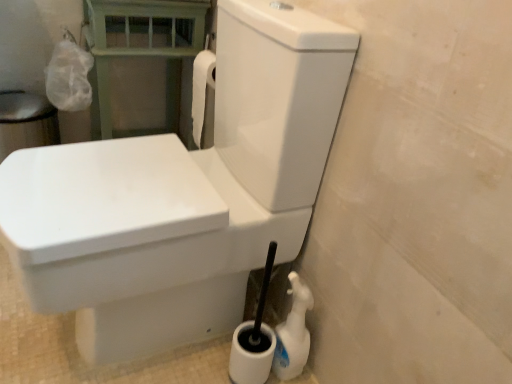
Question: Should I look upward or downward to see green painted wood balustrade at upper left?

Choices:
 (A) down
 (B) up

Answer: (B)

Question: Is white glossy toilet at center beside green painted wood balustrade at upper left?

Choices:
 (A) yes
 (B) no

Answer: (B)

Question: Is white glossy toilet at center aimed at green painted wood balustrade at upper left?

Choices:
 (A) no
 (B) yes

Answer: (A)

Question: Is white glossy toilet at center closer to camera compared to green painted wood balustrade at upper left?

Choices:
 (A) no
 (B) yes

Answer: (B)

Question: Can you confirm if white glossy toilet at center is positioned to the right of green painted wood balustrade at upper left?

Choices:
 (A) yes
 (B) no

Answer: (A)

Question: Is white glossy toilet at center looking in the opposite direction of green painted wood balustrade at upper left?

Choices:
 (A) yes
 (B) no

Answer: (B)

Question: From the image's perspective, would you say white glossy toilet at center is shown under green painted wood balustrade at upper left?

Choices:
 (A) no
 (B) yes

Answer: (B)

Question: Considering the relative sizes of white glossy toilet at center and white plastic spray bottle at lower right in the image provided, is white glossy toilet at center thinner than white plastic spray bottle at lower right?

Choices:
 (A) no
 (B) yes

Answer: (A)

Question: Does white glossy toilet at center appear on the left side of white plastic spray bottle at lower right?

Choices:
 (A) no
 (B) yes

Answer: (B)

Question: Are white glossy toilet at center and white plastic spray bottle at lower right far apart?

Choices:
 (A) yes
 (B) no

Answer: (B)

Question: Could you tell me if white glossy toilet at center is facing white plastic spray bottle at lower right?

Choices:
 (A) yes
 (B) no

Answer: (B)

Question: Does white glossy toilet at center lie in front of white plastic spray bottle at lower right?

Choices:
 (A) no
 (B) yes

Answer: (B)

Question: From the image's perspective, is white glossy toilet at center on white plastic spray bottle at lower right?

Choices:
 (A) yes
 (B) no

Answer: (A)

Question: Considering the relative positions of white plastic spray bottle at lower right and white glossy toilet at center in the image provided, is white plastic spray bottle at lower right to the right of white glossy toilet at center from the viewer's perspective?

Choices:
 (A) yes
 (B) no

Answer: (A)